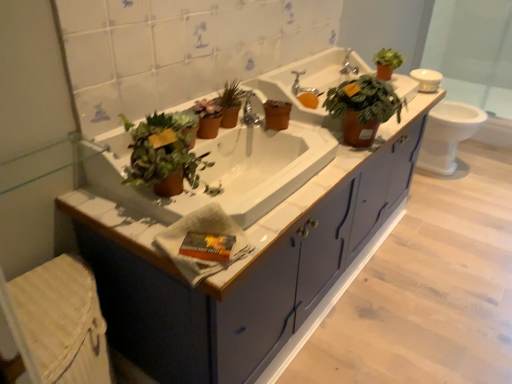
Locate an element on the screen. This screenshot has width=512, height=384. free space in front of white glossy toilet at right is located at coordinates (462, 195).